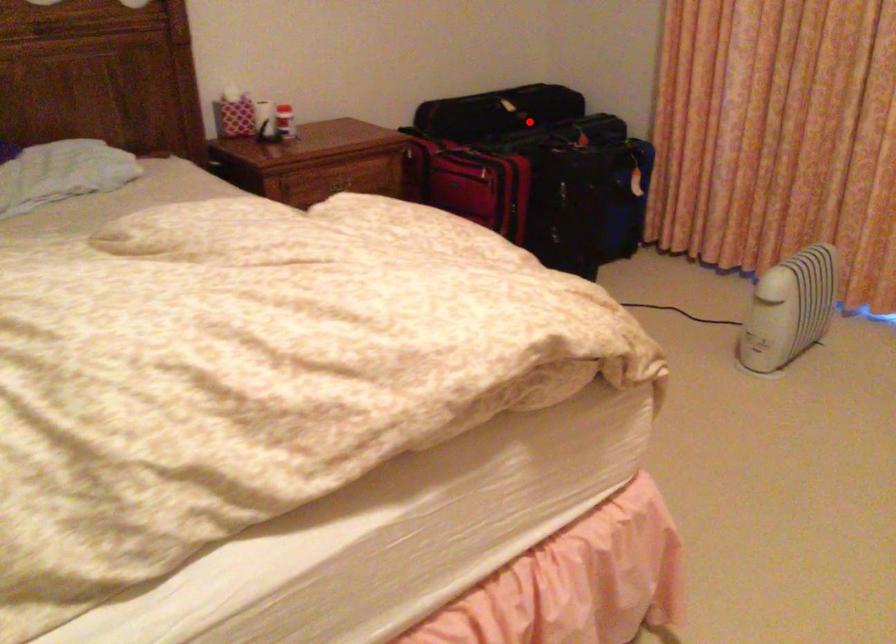
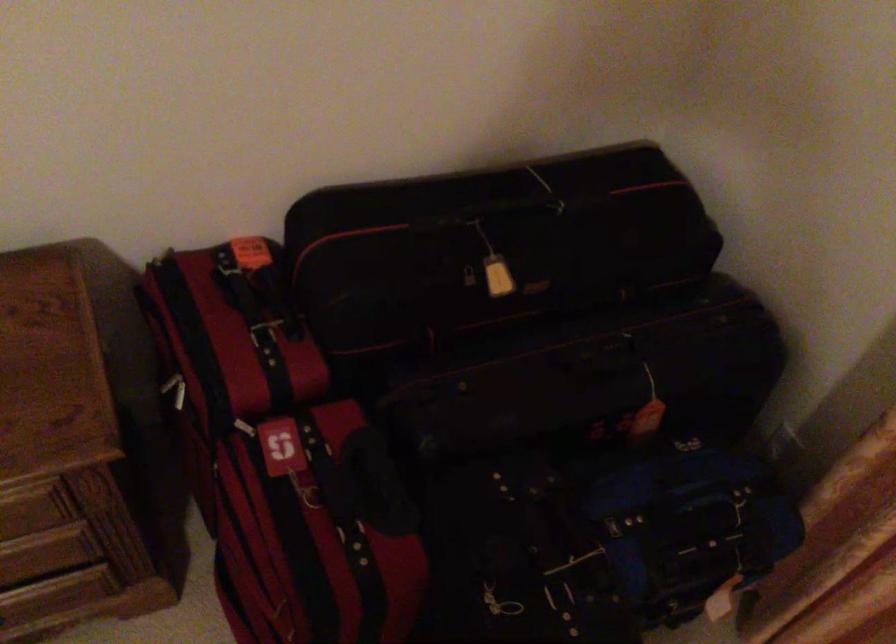
Question: I am providing you with two images of the same scene from different viewpoints. Given a red point in image1, look at the same physical point in image2. Is it:

Choices:
 (A) Closer to the viewpoint
 (B) Farther from the viewpoint

Answer: (A)